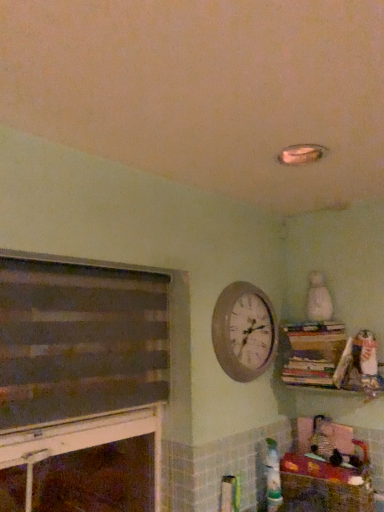
Question: Is white plush bear at upper right facing towards wooden wall clock at upper center?

Choices:
 (A) no
 (B) yes

Answer: (A)

Question: Considering the relative positions of white plush bear at upper right and wooden wall clock at upper center in the image provided, is white plush bear at upper right to the right of wooden wall clock at upper center from the viewer's perspective?

Choices:
 (A) no
 (B) yes

Answer: (B)

Question: Can you confirm if white plush bear at upper right is taller than wooden wall clock at upper center?

Choices:
 (A) yes
 (B) no

Answer: (B)

Question: Is white plush bear at upper right thinner than wooden wall clock at upper center?

Choices:
 (A) yes
 (B) no

Answer: (B)

Question: Is white plush bear at upper right looking in the opposite direction of wooden wall clock at upper center?

Choices:
 (A) no
 (B) yes

Answer: (A)

Question: Is wooden bookshelf at upper right inside the boundaries of white plush bear at upper right, or outside?

Choices:
 (A) outside
 (B) inside

Answer: (A)

Question: Visually, is wooden bookshelf at upper right positioned to the left or to the right of white plush bear at upper right?

Choices:
 (A) left
 (B) right

Answer: (A)

Question: In terms of size, does wooden bookshelf at upper right appear bigger or smaller than white plush bear at upper right?

Choices:
 (A) big
 (B) small

Answer: (A)

Question: Is wooden bookshelf at upper right taller or shorter than white plush bear at upper right?

Choices:
 (A) tall
 (B) short

Answer: (A)

Question: Considering the positions of wooden bookshelf at upper right and dark gray matte fireplace at left in the image, is wooden bookshelf at upper right taller or shorter than dark gray matte fireplace at left?

Choices:
 (A) short
 (B) tall

Answer: (A)

Question: Considering the positions of wooden bookshelf at upper right and dark gray matte fireplace at left in the image, is wooden bookshelf at upper right wider or thinner than dark gray matte fireplace at left?

Choices:
 (A) thin
 (B) wide

Answer: (B)

Question: Is point (332, 325) positioned closer to the camera than point (112, 339)?

Choices:
 (A) closer
 (B) farther

Answer: (B)

Question: From the image's perspective, is wooden bookshelf at upper right above or below dark gray matte fireplace at left?

Choices:
 (A) above
 (B) below

Answer: (A)

Question: From a real-world perspective, is dark gray matte fireplace at left above or below wooden bookshelf at upper right?

Choices:
 (A) above
 (B) below

Answer: (B)

Question: From the image's perspective, is dark gray matte fireplace at left positioned above or below wooden bookshelf at upper right?

Choices:
 (A) below
 (B) above

Answer: (A)